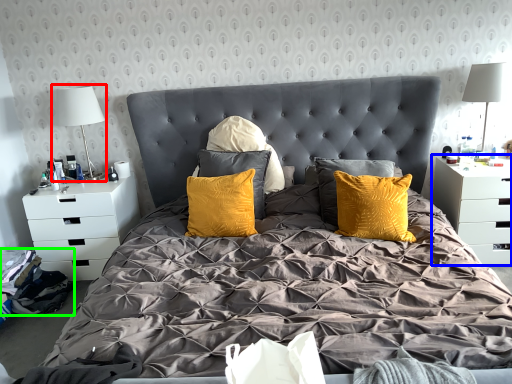
Question: Which object is positioned closest to table lamp (highlighted by a red box)? Select from nightstand (highlighted by a blue box) and material (highlighted by a green box).

Choices:
 (A) nightstand
 (B) material

Answer: (B)